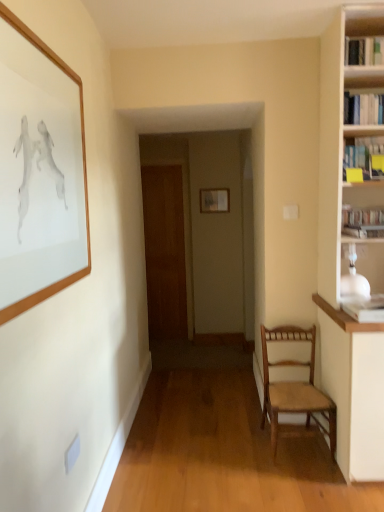
Locate an element on the screen. The image size is (384, 512). vacant space in wooden woven seat chair at lower right (from a real-world perspective) is located at coordinates (306, 452).